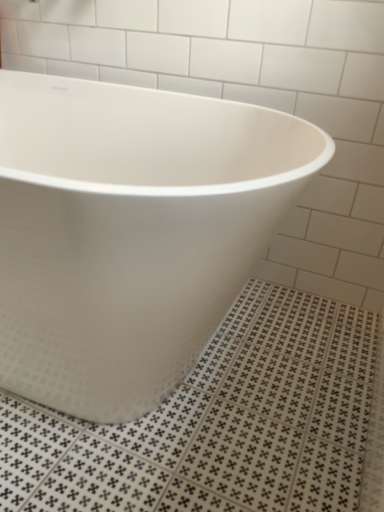
Find the location of a particular element. This screenshot has height=512, width=384. white glossy bathtub at center is located at coordinates (130, 232).

This screenshot has width=384, height=512. Describe the element at coordinates (130, 232) in the screenshot. I see `white glossy bathtub at center` at that location.

Find the location of a particular element. The image size is (384, 512). white glossy bathtub at center is located at coordinates (130, 232).